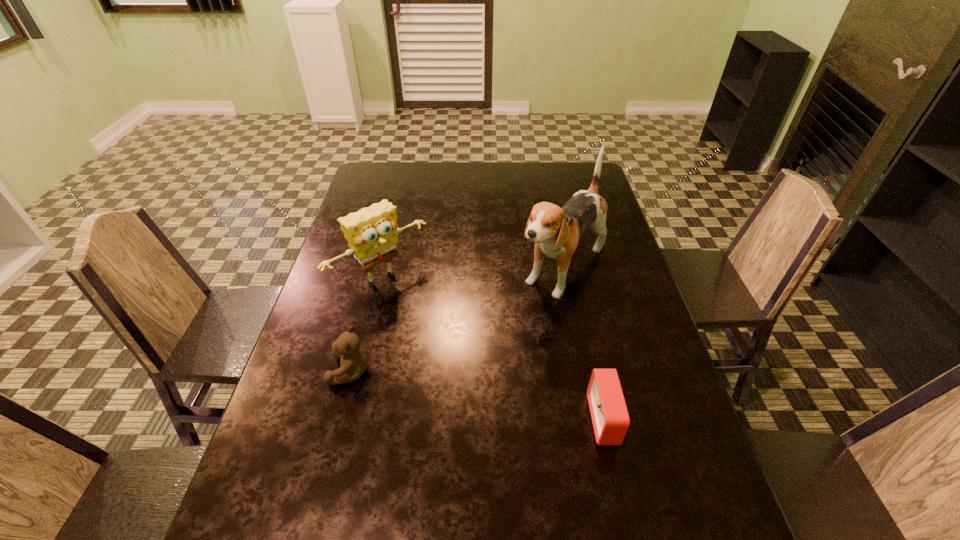
At what (x,y) coordinates should I click in order to perform the action: click on vacant space at the far edge of the desktop. Please return your answer as a coordinate pair (x, y). Looking at the image, I should click on (520, 171).

The image size is (960, 540). What are the coordinates of `vacant region at the near edge of the desktop` in the screenshot? It's located at (599, 487).

What are the coordinates of `free location at the left edge` in the screenshot? It's located at (366, 196).

The height and width of the screenshot is (540, 960). Identify the location of free location at the right edge of the desktop. tap(626, 440).

Where is `vacant space at the far left corner of the desktop`? vacant space at the far left corner of the desktop is located at coordinates (399, 187).

This screenshot has width=960, height=540. I want to click on free space at the near right corner of the desktop, so click(678, 509).

I want to click on blank region between the third shortest object and the tallest object, so click(473, 274).

Where is `unoccupied position between the sponge and the third farthest object`? The width and height of the screenshot is (960, 540). unoccupied position between the sponge and the third farthest object is located at coordinates (367, 325).

The width and height of the screenshot is (960, 540). Identify the location of vacant point located between the teddy bear and the second tallest object. (367, 325).

Locate an element on the screen. The height and width of the screenshot is (540, 960). free space that is in between the puppy and the third shortest object is located at coordinates [473, 274].